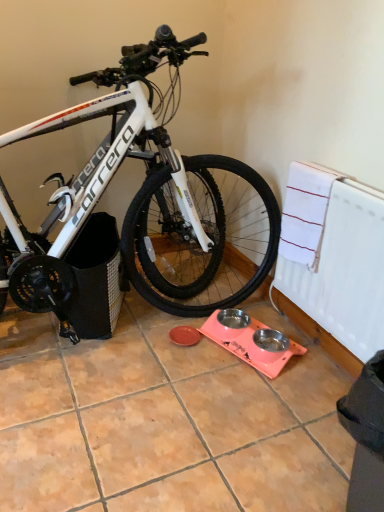
Where is `free space on the front side of white matte bicycle at left`? Image resolution: width=384 pixels, height=512 pixels. free space on the front side of white matte bicycle at left is located at coordinates (152, 410).